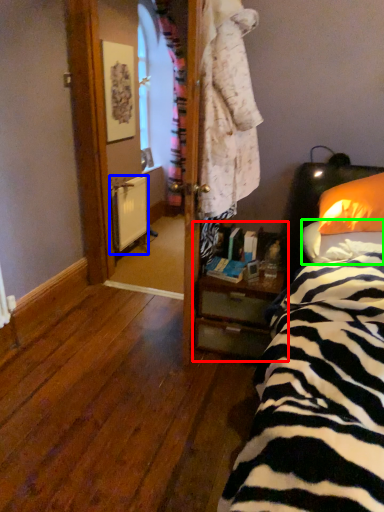
Question: Considering the real-world distances, which object is closest to nightstand (highlighted by a red box)? radiator (highlighted by a blue box) or pillow (highlighted by a green box).

Choices:
 (A) radiator
 (B) pillow

Answer: (B)